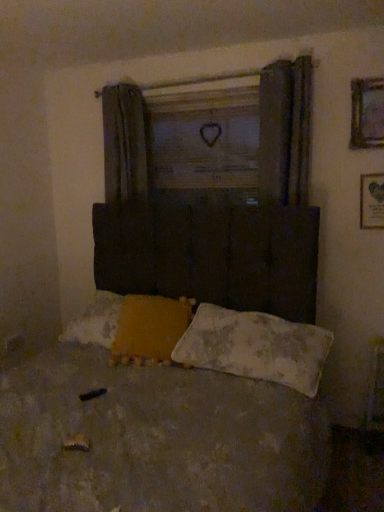
Question: Is wooden heart at center oriented towards yellow fabric pillow at lower center, placed as the first pillow when sorted from left to right?

Choices:
 (A) no
 (B) yes

Answer: (A)

Question: Can you confirm if wooden heart at center is positioned to the right of yellow fabric pillow at lower center, placed as the first pillow when sorted from left to right?

Choices:
 (A) yes
 (B) no

Answer: (A)

Question: Is wooden heart at center thinner than yellow fabric pillow at lower center, placed as the first pillow when sorted from left to right?

Choices:
 (A) yes
 (B) no

Answer: (A)

Question: Would you say wooden heart at center is outside yellow fabric pillow at lower center, placed as the first pillow when sorted from left to right?

Choices:
 (A) no
 (B) yes

Answer: (B)

Question: From the image's perspective, is wooden heart at center located beneath yellow fabric pillow at lower center, placed as the first pillow when sorted from left to right?

Choices:
 (A) no
 (B) yes

Answer: (A)

Question: Is wooden heart at center to the left of yellow fabric pillow at lower center, the 2th pillow positioned from the right, from the viewer's perspective?

Choices:
 (A) yes
 (B) no

Answer: (B)

Question: Considering the relative sizes of white textured pillow at lower center, placed as the second pillow when sorted from left to right, and wooden framed picture at upper right, arranged as the 2th picture frame when viewed from the top, in the image provided, is white textured pillow at lower center, placed as the second pillow when sorted from left to right, thinner than wooden framed picture at upper right, arranged as the 2th picture frame when viewed from the top,?

Choices:
 (A) no
 (B) yes

Answer: (A)

Question: Are white textured pillow at lower center, placed as the second pillow when sorted from left to right, and wooden framed picture at upper right, arranged as the 2th picture frame when viewed from the top, beside each other?

Choices:
 (A) yes
 (B) no

Answer: (B)

Question: Would you say white textured pillow at lower center, placed as the second pillow when sorted from left to right, contains wooden framed picture at upper right, marked as the 1th picture frame in a bottom-to-top arrangement?

Choices:
 (A) yes
 (B) no

Answer: (B)

Question: Is white textured pillow at lower center, placed as the second pillow when sorted from left to right, at the left side of wooden framed picture at upper right, arranged as the 2th picture frame when viewed from the top?

Choices:
 (A) no
 (B) yes

Answer: (B)

Question: From a real-world perspective, is white textured pillow at lower center, placed as the second pillow when sorted from left to right, located beneath wooden framed picture at upper right, marked as the 1th picture frame in a bottom-to-top arrangement?

Choices:
 (A) no
 (B) yes

Answer: (B)

Question: Can you confirm if white textured pillow at lower center, the 1th pillow from the right, is taller than wooden framed picture at upper right, marked as the 1th picture frame in a bottom-to-top arrangement?

Choices:
 (A) yes
 (B) no

Answer: (B)

Question: Is worn fabric bed at center located outside wooden framed picture at upper right, which is the first picture frame from top to bottom?

Choices:
 (A) no
 (B) yes

Answer: (B)